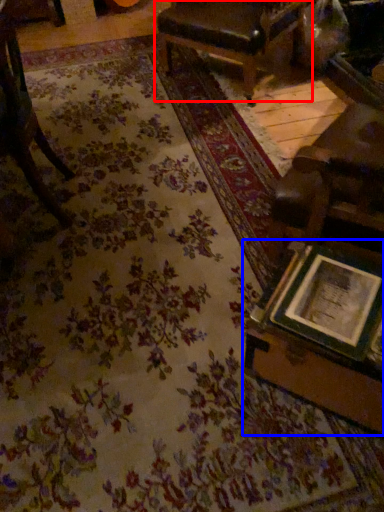
Question: Which object appears closest to the camera in this image, chair (highlighted by a red box) or table (highlighted by a blue box)?

Choices:
 (A) chair
 (B) table

Answer: (B)